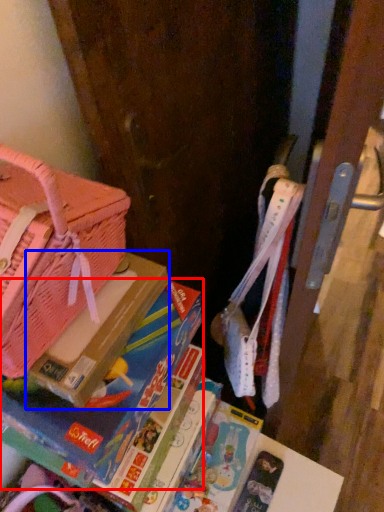
Question: Which object is closer to the camera taking this photo, book (highlighted by a red box) or paperback book (highlighted by a blue box)?

Choices:
 (A) book
 (B) paperback book

Answer: (A)